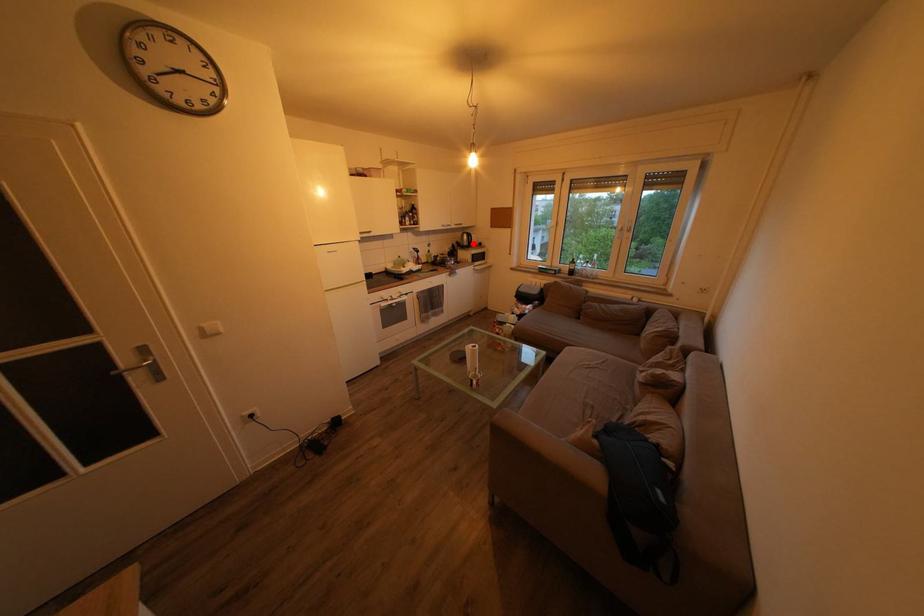
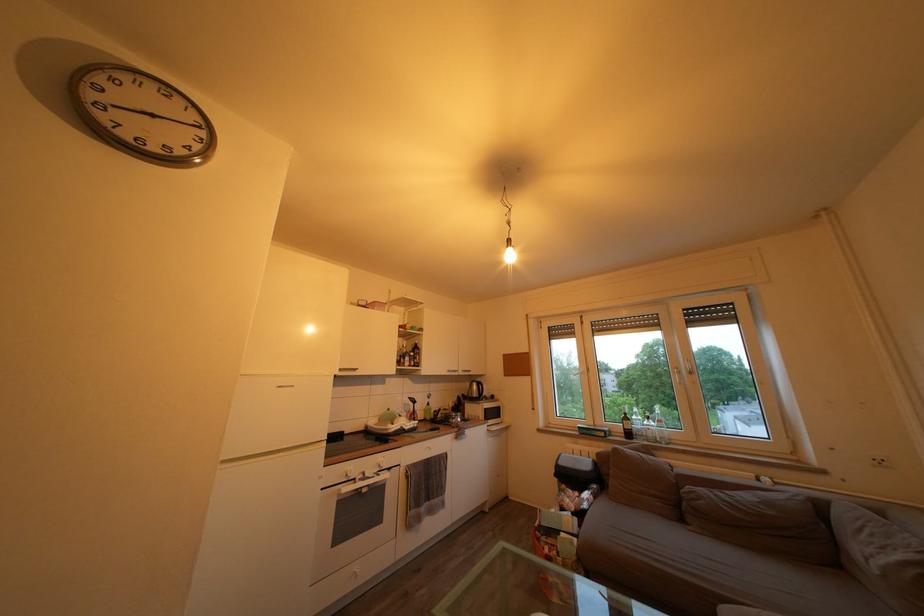
Find the pixel in the second image that matches the highlighted location in the first image.

(482, 392)